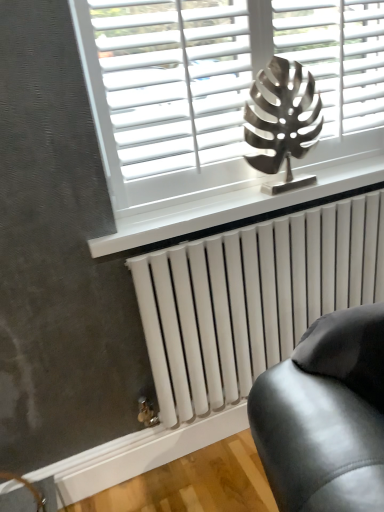
Describe the element at coordinates (232, 206) in the screenshot. I see `white glossy radiator at lower center` at that location.

The width and height of the screenshot is (384, 512). I want to click on white glossy radiator at lower center, so click(232, 206).

Describe the element at coordinates (220, 86) in the screenshot. Image resolution: width=384 pixels, height=512 pixels. I see `metallic leaf at center` at that location.

In order to face white metallic radiator at lower center, should I rotate leftwards or rightwards?

Turn right approximately 11.727 degrees to face it.

At what (x,y) coordinates should I click in order to perform the action: click on white glossy radiator at lower center. Please return your answer as a coordinate pair (x, y). Looking at the image, I should click on (232, 206).

Can you tell me how much white metallic radiator at lower center and metallic leaf at center differ in facing direction?

They differ by 0.00303 degrees in their facing directions.

Is point (151, 275) positioned behind point (331, 91)?

That is False.

This screenshot has height=512, width=384. Find the location of `window located above the white metallic radiator at lower center (from a real-world perspective)`. window located above the white metallic radiator at lower center (from a real-world perspective) is located at coordinates (220, 86).

Considering the sizes of objects white matte blinds at upper center and white metallic radiator at lower center in the image provided, who is thinner, white matte blinds at upper center or white metallic radiator at lower center?

Thinner between the two is white matte blinds at upper center.

From the picture: How far apart are white matte blinds at upper center and white metallic radiator at lower center?

19.67 inches.

Based on the photo, considering the relative positions of white matte blinds at upper center and white metallic radiator at lower center in the image provided, is white matte blinds at upper center to the left of white metallic radiator at lower center from the viewer's perspective?

Indeed, white matte blinds at upper center is positioned on the left side of white metallic radiator at lower center.

From a real-world perspective, which is physically below, white matte blinds at upper center or white metallic radiator at lower center?

In real-world perspective, white metallic radiator at lower center is lower.

From the image's perspective, is white glossy radiator at lower center over white matte blinds at upper center?

No, from the image's perspective, white glossy radiator at lower center is not above white matte blinds at upper center.

Is white glossy radiator at lower center taller or shorter than white matte blinds at upper center?

Considering their sizes, white glossy radiator at lower center has less height than white matte blinds at upper center.

Can you tell me how much white metallic radiator at lower center and white glossy radiator at lower center differ in facing direction?

The angular difference between white metallic radiator at lower center and white glossy radiator at lower center is 0.00174 degrees.

Do you think white metallic radiator at lower center is within white glossy radiator at lower center, or outside of it?

white metallic radiator at lower center cannot be found inside white glossy radiator at lower center.

How distant is white metallic radiator at lower center from white glossy radiator at lower center?

The distance of white metallic radiator at lower center from white glossy radiator at lower center is 10.20 inches.

Considering the relative sizes of white metallic radiator at lower center and white glossy radiator at lower center in the image provided, is white metallic radiator at lower center smaller than white glossy radiator at lower center?

No.

From the image's perspective, is metallic leaf at center positioned above or below white metallic radiator at lower center?

metallic leaf at center is situated higher than white metallic radiator at lower center in the image.

How much distance is there between metallic leaf at center and white metallic radiator at lower center?

metallic leaf at center and white metallic radiator at lower center are 16.75 inches apart from each other.

Is metallic leaf at center turned away from white metallic radiator at lower center?

No, white metallic radiator at lower center is not at the back of metallic leaf at center.

Which is in front, metallic leaf at center or white metallic radiator at lower center?

metallic leaf at center is more forward.

How much distance is there between white glossy radiator at lower center and white metallic radiator at lower center?

white glossy radiator at lower center and white metallic radiator at lower center are 25.92 centimeters apart.

Is white glossy radiator at lower center smaller than white metallic radiator at lower center?

Correct, white glossy radiator at lower center occupies less space than white metallic radiator at lower center.

Considering the sizes of objects white glossy radiator at lower center and white metallic radiator at lower center in the image provided, who is thinner, white glossy radiator at lower center or white metallic radiator at lower center?

With smaller width is white metallic radiator at lower center.

In the scene shown: Considering the positions of objects white glossy radiator at lower center and white metallic radiator at lower center in the image provided, who is more to the right, white glossy radiator at lower center or white metallic radiator at lower center?

Positioned to the right is white metallic radiator at lower center.

Would you say metallic leaf at center is part of white glossy radiator at lower center's contents?

No, metallic leaf at center is not inside white glossy radiator at lower center.

Based on their positions, is white glossy radiator at lower center located to the left or right of metallic leaf at center?

Based on their positions, white glossy radiator at lower center is located to the right of metallic leaf at center.

Does point (301, 203) come in front of point (120, 195)?

No, (301, 203) is behind (120, 195).

Considering the relative sizes of white glossy radiator at lower center and metallic leaf at center in the image provided, is white glossy radiator at lower center wider than metallic leaf at center?

Indeed, white glossy radiator at lower center has a greater width compared to metallic leaf at center.

In the image, there is a metallic leaf at center. Where is `radiator below it (from a real-world perspective)`? radiator below it (from a real-world perspective) is located at coordinates (251, 298).

In the image, there is a white matte blinds at upper center. At what (x,y) coordinates should I click in order to perform the action: click on radiator below it (from the image's perspective). Please return your answer as a coordinate pair (x, y). Image resolution: width=384 pixels, height=512 pixels. Looking at the image, I should click on (251, 298).

Estimate the real-world distances between objects in this image. Which object is closer to metallic leaf at center, white metallic radiator at lower center or white matte blinds at upper center?

white matte blinds at upper center.

Based on their spatial positions, is white metallic radiator at lower center or white matte blinds at upper center further from white glossy radiator at lower center?

white matte blinds at upper center is further to white glossy radiator at lower center.

From the image, which object appears to be nearer to white glossy radiator at lower center, white matte blinds at upper center or white metallic radiator at lower center?

Based on the image, white metallic radiator at lower center appears to be nearer to white glossy radiator at lower center.

Which object lies nearer to the anchor point metallic leaf at center, white metallic radiator at lower center or white glossy radiator at lower center?

white glossy radiator at lower center is closer to metallic leaf at center.

Looking at the image, which one is located further to white matte blinds at upper center, metallic leaf at center or white glossy radiator at lower center?

Based on the image, white glossy radiator at lower center appears to be further to white matte blinds at upper center.

In the scene shown: Considering their positions, is white metallic radiator at lower center positioned closer to white glossy radiator at lower center than metallic leaf at center?

Among the two, metallic leaf at center is located nearer to white glossy radiator at lower center.

When comparing their distances from white matte blinds at upper center, does metallic leaf at center or white metallic radiator at lower center seem further?

white metallic radiator at lower center is further to white matte blinds at upper center.

When comparing their distances from white matte blinds at upper center, does white metallic radiator at lower center or white glossy radiator at lower center seem closer?

white glossy radiator at lower center is closer to white matte blinds at upper center.

Locate an element on the screen. The width and height of the screenshot is (384, 512). window sill between white matte blinds at upper center and white metallic radiator at lower center in the up-down direction is located at coordinates (232, 206).

What are the coordinates of `window sill between metallic leaf at center and white metallic radiator at lower center from top to bottom` in the screenshot? It's located at (232, 206).

Where is `blind between metallic leaf at center and white metallic radiator at lower center in the up-down direction`? blind between metallic leaf at center and white metallic radiator at lower center in the up-down direction is located at coordinates (173, 80).

You are a GUI agent. You are given a task and a screenshot of the screen. Output one action in this format:
    pyautogui.click(x=<x>, y=<y>)
    Task: Click on the blind between metallic leaf at center and white glossy radiator at lower center in the vertical direction
    
    Given the screenshot: What is the action you would take?
    pyautogui.click(x=173, y=80)